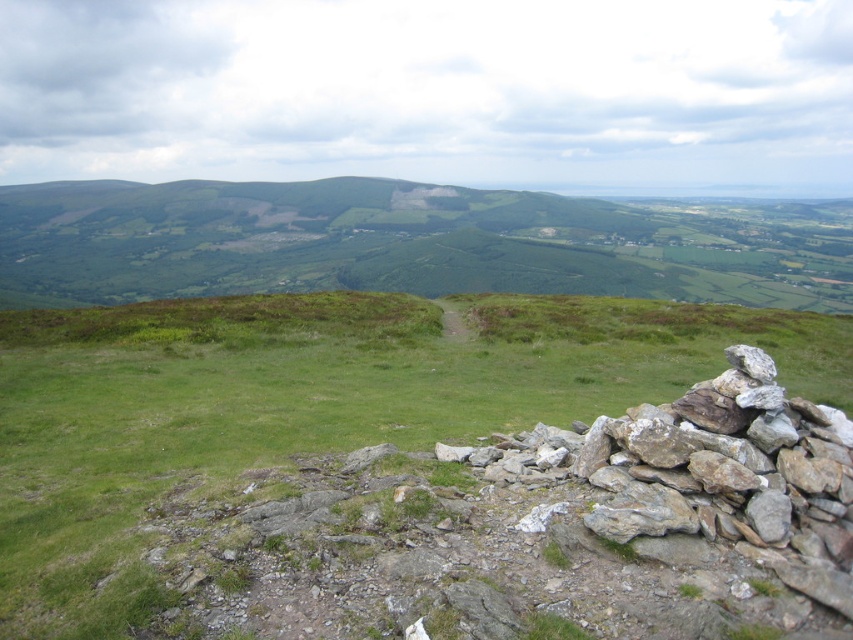
You are a hiker standing on the grassy slope and want to walk towards the valley below. Which direction should you go relative to the green grassy at center and the green grassy hillside at center?

The green grassy at center is in front of the green grassy hillside at center, so you should walk towards the green grassy at center to reach the valley below.

You are a hiker trying to navigate the valley. You see the green grassy at center and the green grassy hillside at center. Which one is located below the other?

The green grassy at center is positioned under the green grassy hillside at center, meaning the green grassy at center is below the green grassy hillside at center.

You are standing at the highest point of the valley and want to walk to the green grassy at center. According to the coordinates provided, in which direction should you head?

The green grassy at center is located at coordinates point (364, 470), so you should head towards the lower center direction from your current position at the highest point.